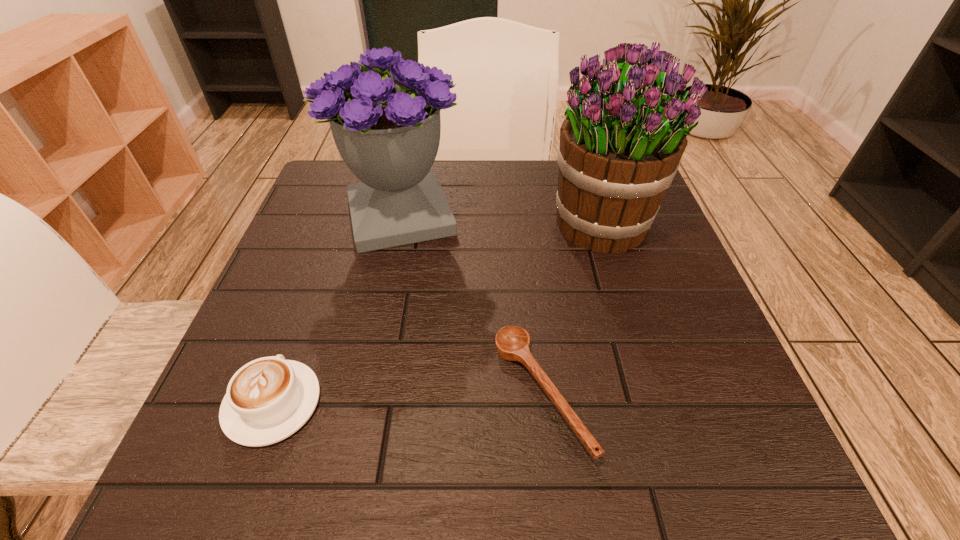
What are the coordinates of `cappuccino located at the near edge` in the screenshot? It's located at (267, 400).

What are the coordinates of `wooden spoon at the near edge` in the screenshot? It's located at (512, 342).

Where is `bouquet at the left edge`? bouquet at the left edge is located at coordinates (387, 130).

This screenshot has height=540, width=960. In order to click on cappuccino positioned at the left edge in this screenshot , I will do `click(267, 400)`.

Identify the location of object that is at the right edge. The height and width of the screenshot is (540, 960). (621, 143).

Where is `object located at the far left corner`? The height and width of the screenshot is (540, 960). object located at the far left corner is located at coordinates (387, 130).

Locate an element on the screen. object that is positioned at the near left corner is located at coordinates (267, 400).

I want to click on object that is at the far right corner, so point(621,143).

Where is `free space at the far edge`? The image size is (960, 540). free space at the far edge is located at coordinates (521, 193).

Find the location of a particular element. This screenshot has width=960, height=540. free region at the near edge of the desktop is located at coordinates (519, 439).